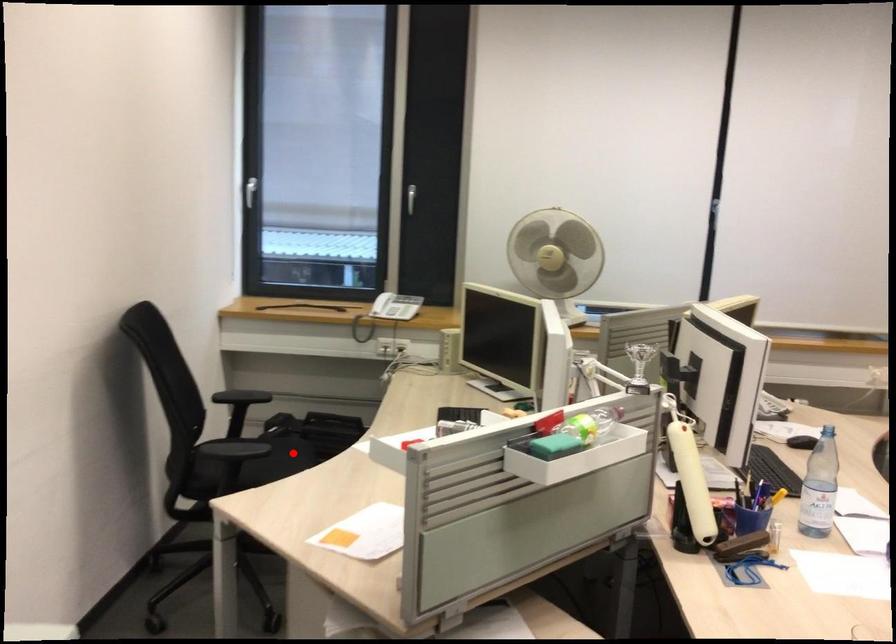
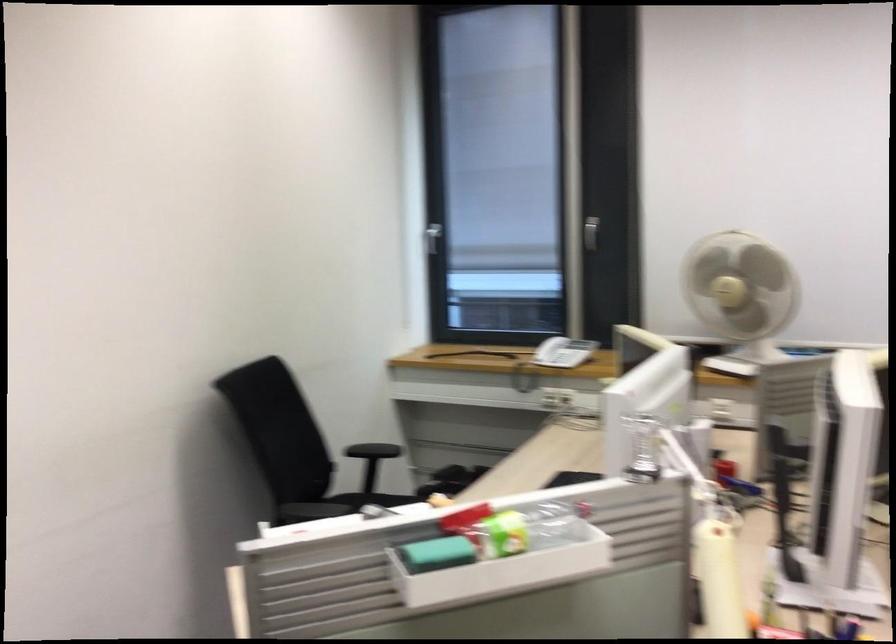
Question: I am providing you with two images of the same scene from different viewpoints. A red point is marked on the first image. At the location where the point appears in image 1, is it still visible in image 2?

Choices:
 (A) Yes
 (B) No

Answer: (B)